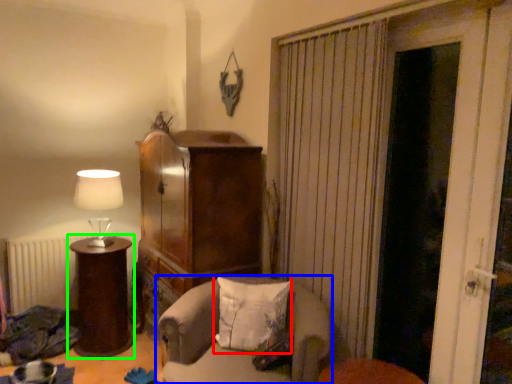
Question: Based on their relative distances, which object is nearer to pillow (highlighted by a red box)? Choose from chair (highlighted by a blue box) and furniture (highlighted by a green box).

Choices:
 (A) chair
 (B) furniture

Answer: (A)